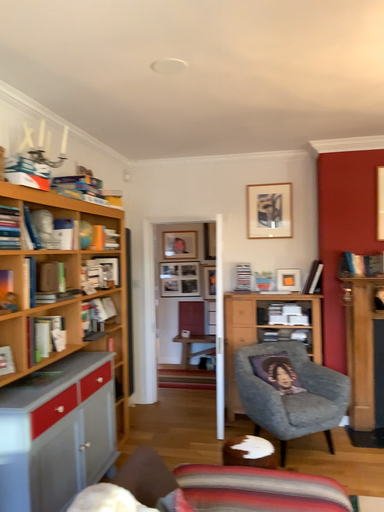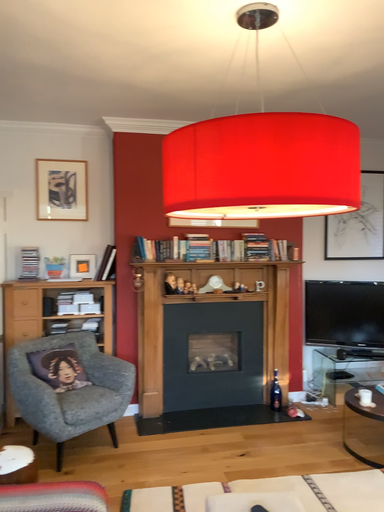
Question: Which way did the camera rotate in the video?

Choices:
 (A) rotated left
 (B) rotated right

Answer: (B)